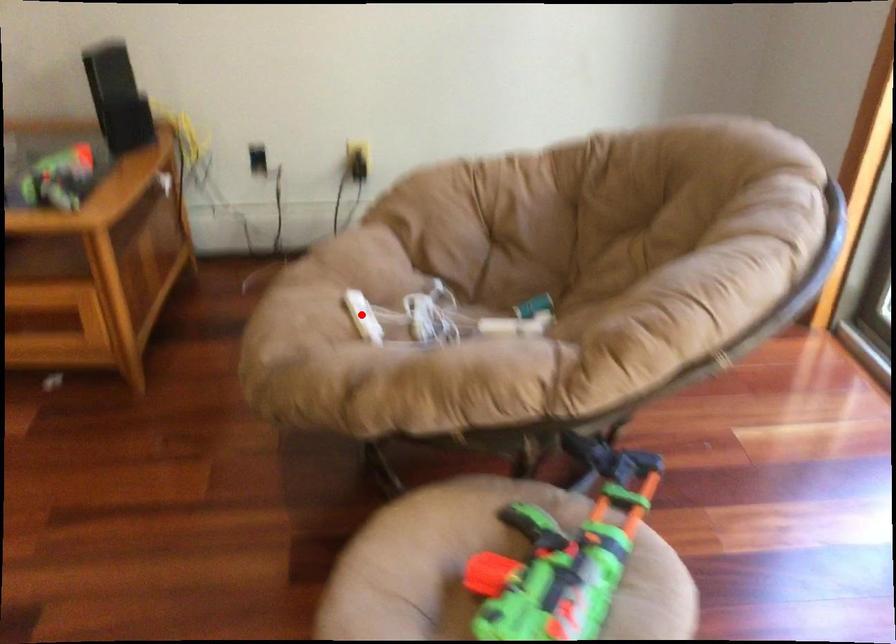
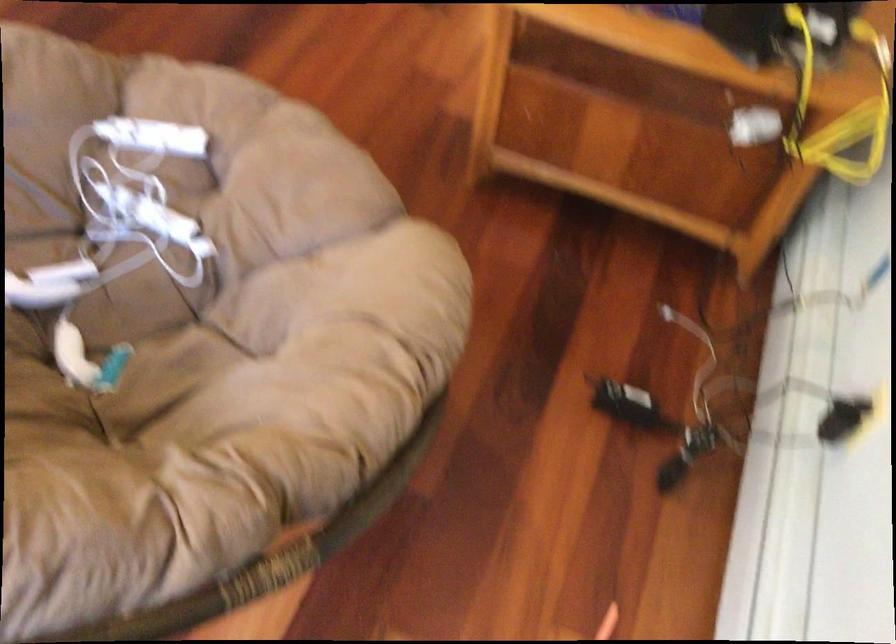
Find the pixel in the second image that matches the highlighted location in the first image.

(152, 137)